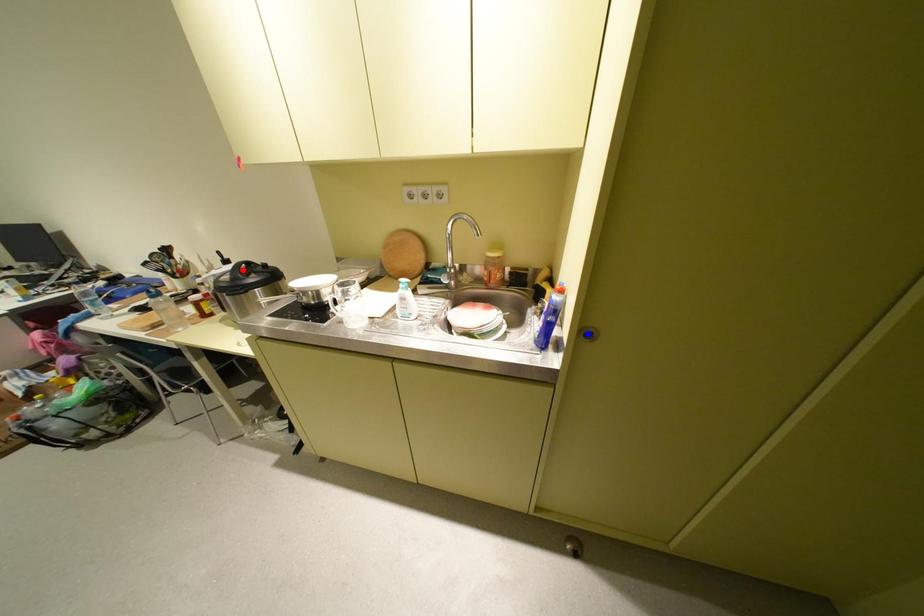
Question: In the image, two points are highlighted. Which point is nearer to the camera? Reply with the corresponding letter.

Choices:
 (A) blue point
 (B) red point

Answer: (A)